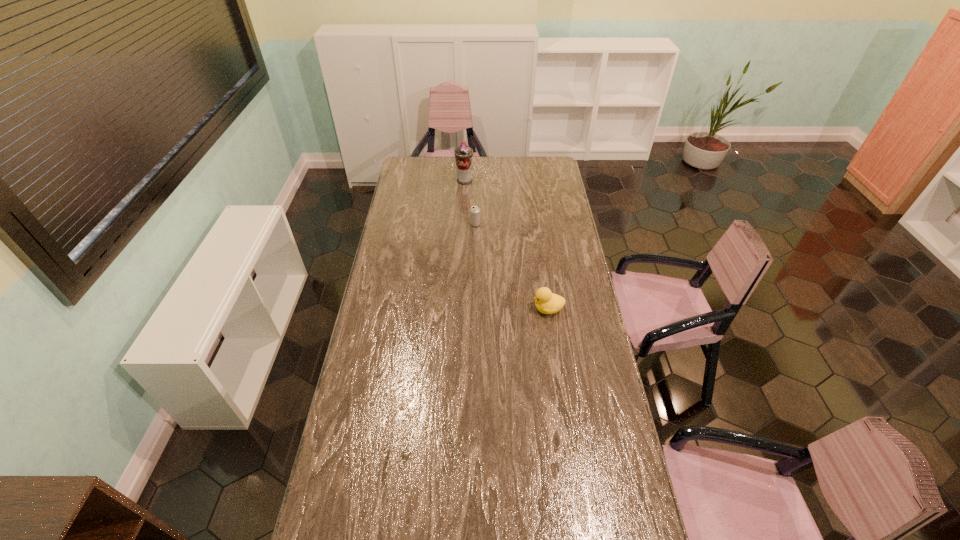
You are a GUI agent. You are given a task and a screenshot of the screen. Output one action in this format:
    pyautogui.click(x=<x>, y=<y>)
    Task: Click on the free region located 0.240m on the front of the shortest object
    The width and height of the screenshot is (960, 540).
    Given the screenshot: What is the action you would take?
    pyautogui.click(x=474, y=259)

The image size is (960, 540). In order to click on object at the far edge in this screenshot , I will do `click(463, 154)`.

Locate an element on the screen. The height and width of the screenshot is (540, 960). object located at the right edge is located at coordinates (546, 302).

Identify the location of free space at the left edge of the desktop. The height and width of the screenshot is (540, 960). (411, 217).

The width and height of the screenshot is (960, 540). In the image, there is a desktop. In order to click on free space at the right edge in this screenshot , I will do `click(551, 272)`.

Where is `vacant area between the nearest object and the beer can`? The image size is (960, 540). vacant area between the nearest object and the beer can is located at coordinates (512, 267).

The width and height of the screenshot is (960, 540). Identify the location of vacant space in between the aerosol can and the nearest object. (506, 245).

Locate an element on the screen. free space between the rightmost object and the aerosol can is located at coordinates (506, 245).

Where is `empty space that is in between the tallest object and the nearest object`? Image resolution: width=960 pixels, height=540 pixels. empty space that is in between the tallest object and the nearest object is located at coordinates (506, 245).

Where is `vacant area that lies between the nearest object and the beer can`? vacant area that lies between the nearest object and the beer can is located at coordinates (512, 267).